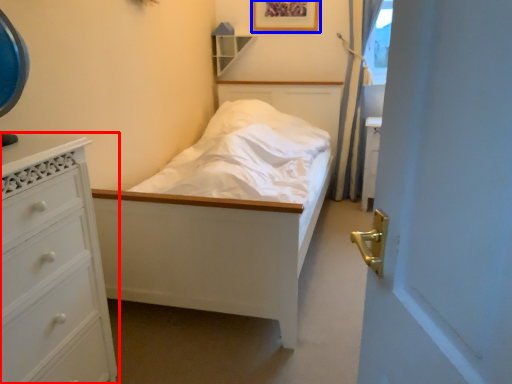
Question: Among these objects, which one is farthest to the camera, chest of drawers (highlighted by a red box) or picture frame (highlighted by a blue box)?

Choices:
 (A) chest of drawers
 (B) picture frame

Answer: (B)